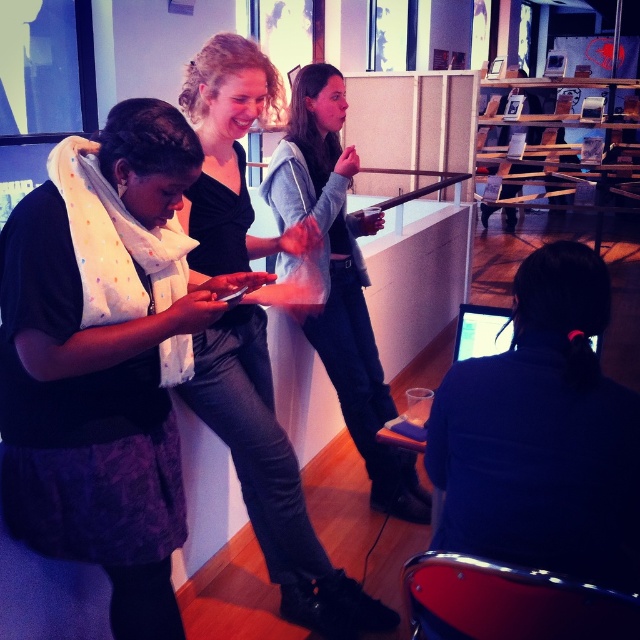
In the scene shown: Can you confirm if matte black scarf at left is taller than light gray sweater at center?

Incorrect, matte black scarf at left's height is not larger of light gray sweater at center's.

Between matte black scarf at left and light gray sweater at center, which one has less height?

matte black scarf at left is shorter.

Does point (19, 211) come closer to viewer compared to point (326, 316)?

That is True.

This screenshot has height=640, width=640. Find the location of `matte black scarf at left`. matte black scarf at left is located at coordinates (92, 419).

Is matte black scarf at left smaller than matte black sweater at upper center?

Yes, matte black scarf at left is smaller than matte black sweater at upper center.

Which is behind, point (99, 522) or point (385, 611)?

Positioned behind is point (385, 611).

The image size is (640, 640). Identify the location of matte black scarf at left. (92, 419).

Does matte black sweater at upper center have a lesser height compared to light gray sweater at center?

No, matte black sweater at upper center is not shorter than light gray sweater at center.

Is point (243, 413) positioned before point (339, 164)?

Yes, point (243, 413) is in front of point (339, 164).

The width and height of the screenshot is (640, 640). Identify the location of matte black sweater at upper center. (273, 477).